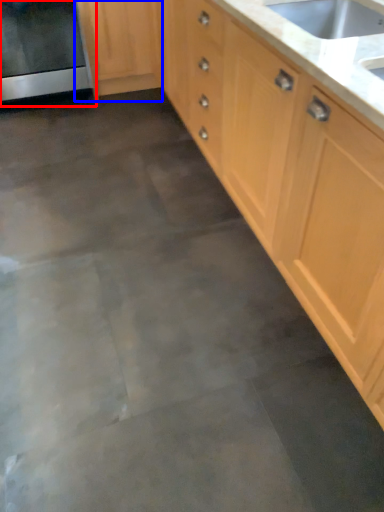
Question: Among these objects, which one is nearest to the camera, oven (highlighted by a red box) or cabinetry (highlighted by a blue box)?

Choices:
 (A) oven
 (B) cabinetry

Answer: (A)